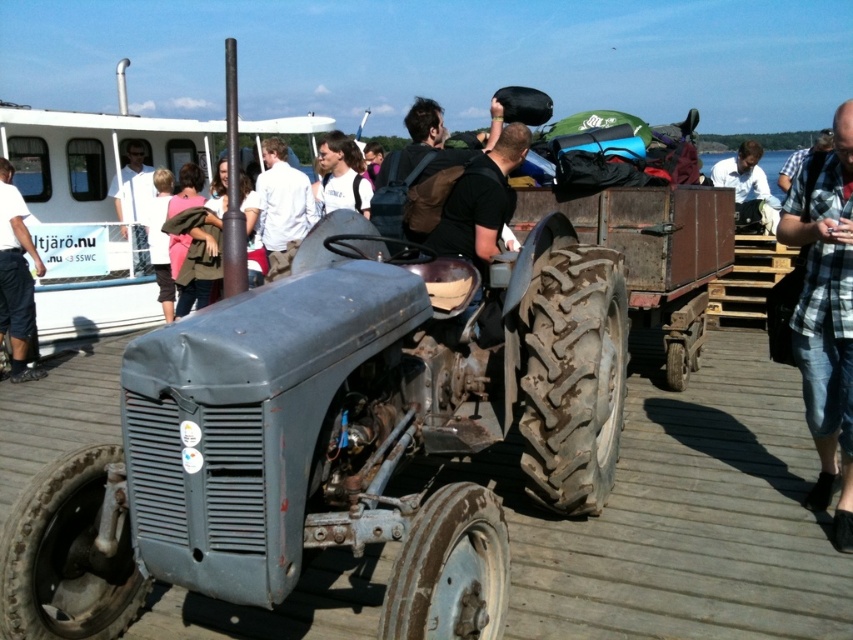
Question: Does dark blue jeans at left have a greater width compared to light gray backpack at center?

Choices:
 (A) no
 (B) yes

Answer: (A)

Question: Among these points, which one is nearest to the camera?

Choices:
 (A) (32, 298)
 (B) (828, 131)
 (C) (759, 170)

Answer: (A)

Question: Among these points, which one is farthest from the camera?

Choices:
 (A) (148, 188)
 (B) (291, 474)

Answer: (A)

Question: Which object appears farthest from the camera in this image?

Choices:
 (A) plaid shirt at right
 (B) matte gray tractor at center
 (C) white matte shirt at center
 (D) light blue shirt at upper center

Answer: (D)

Question: Does white matte boat at upper left have a larger size compared to dark blue jeans at left?

Choices:
 (A) yes
 (B) no

Answer: (A)

Question: Is matte gray tractor at center wider than white matte shirt at center?

Choices:
 (A) yes
 (B) no

Answer: (A)